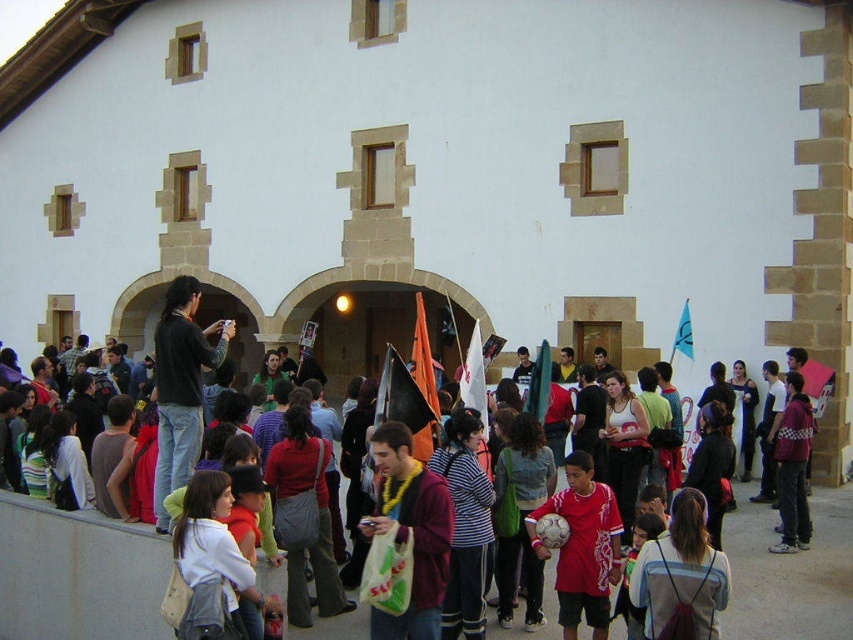
You are a photographer at the event and need to capture both the matte red shirt at center and the orange fabric flag at center in a single frame. Which object will appear larger in the photo?

The orange fabric flag at center will appear larger in the photo because it is bigger than the matte red shirt at center.

You are standing in front of the white building with arched doorways and want to hand a small item to the person wearing the dark gray sweater at center. Considering the distance, can you comfortably reach them without moving closer?

The dark gray sweater at center is 27.93 meters away from the viewer. Since this distance is quite far, you would not be able to comfortably reach them without moving closer.

You are standing in front of the white building and want to take a photo of both the matte red shirt at center and the green fabric flag at center. Which object should you focus on first to ensure both are in the frame?

You should focus on the matte red shirt at center first since it is closer to you than the green fabric flag at center, ensuring both are in the frame.